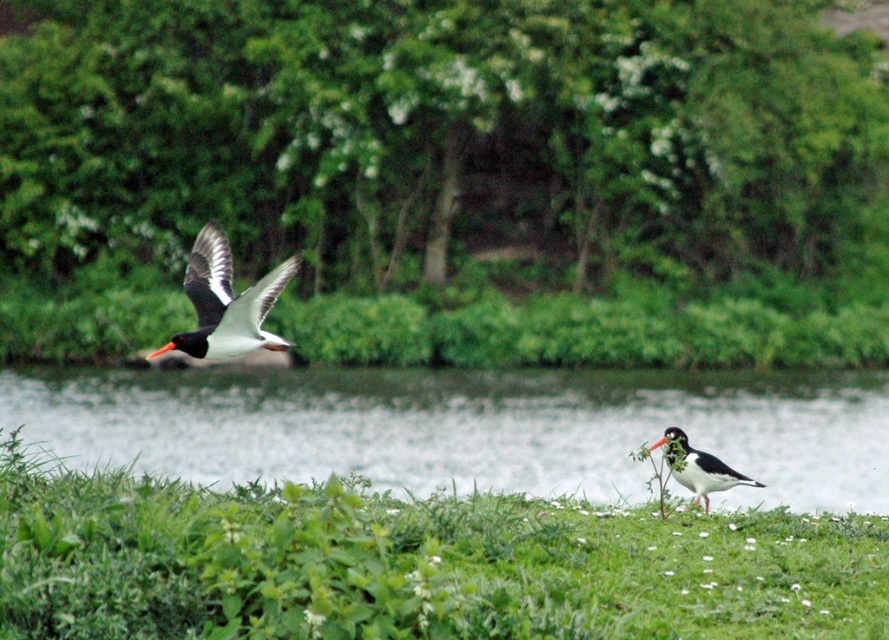
Question: Which object is farther from the camera taking this photo?

Choices:
 (A) black and white bird at upper left
 (B) clear water at grass right

Answer: (A)

Question: Can you confirm if clear water at grass right is positioned to the left of speckled white bird at lower right?

Choices:
 (A) no
 (B) yes

Answer: (A)

Question: Considering the relative positions of green grassy at lower center and black and white bird at upper left in the image provided, where is green grassy at lower center located with respect to black and white bird at upper left?

Choices:
 (A) below
 (B) above

Answer: (A)

Question: Estimate the real-world distances between objects in this image. Which object is farther from the clear water at grass right?

Choices:
 (A) speckled white bird at lower right
 (B) green grassy at lower center

Answer: (A)

Question: Can you confirm if green grassy at lower center is positioned to the left of speckled white bird at lower right?

Choices:
 (A) no
 (B) yes

Answer: (B)

Question: Which point is farther from the camera taking this photo?

Choices:
 (A) (188, 348)
 (B) (671, 454)
 (C) (851, 461)
 (D) (382, 625)

Answer: (C)